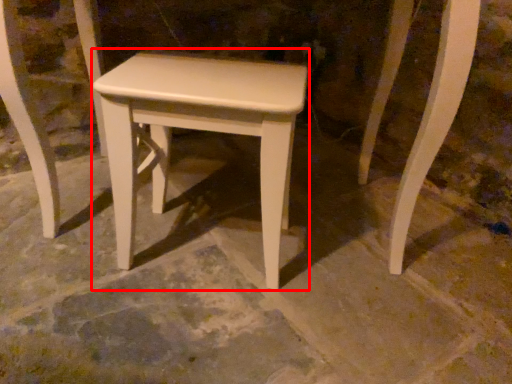
Question: From the image's perspective, what is the correct spatial positioning of stool (annotated by the red box) in reference to concrete?

Choices:
 (A) above
 (B) below

Answer: (A)